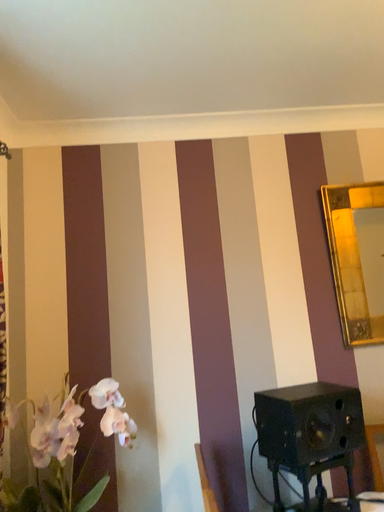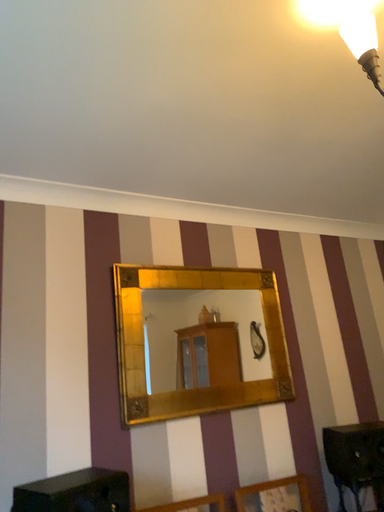
Question: How did the camera likely rotate when shooting the video?

Choices:
 (A) rotated downward
 (B) rotated upward

Answer: (B)